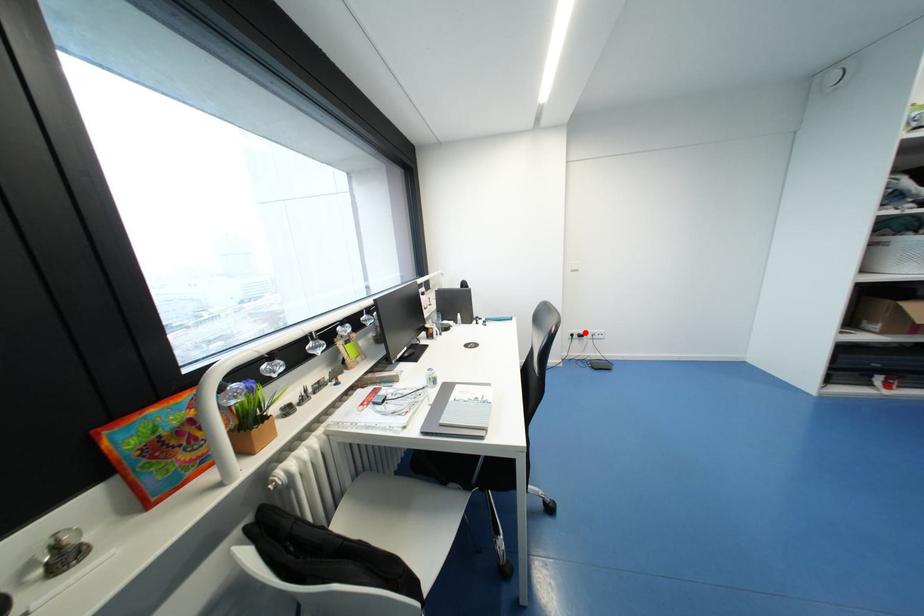
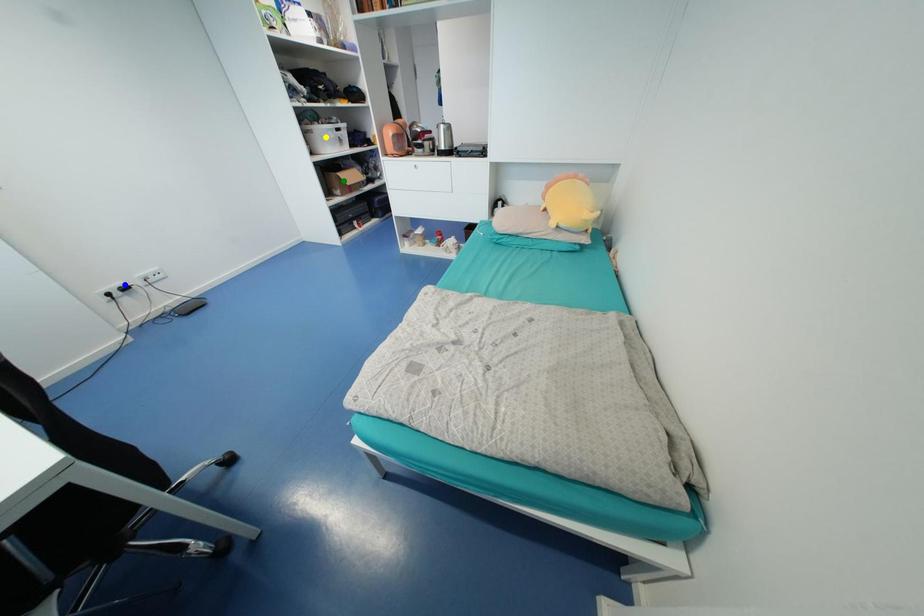
Question: I am providing you with two images of the same scene from different viewpoints. A red point is marked on the first image. You are given multiple points on the second image. Which spot in image 2 lines up with the point in image 1?

Choices:
 (A) yellow point
 (B) green point
 (C) blue point

Answer: (C)